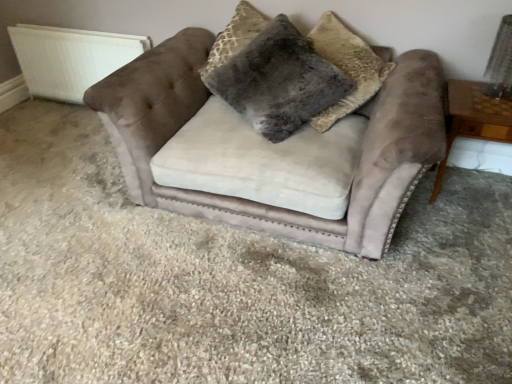
The height and width of the screenshot is (384, 512). I want to click on fuzzy gray pillow at center, which appears as the 2th pillow when viewed from the left, so click(x=347, y=67).

What is the approximate width of velvet couch at center?

It is 3.55 feet.

In order to face wooden side table at right, should I rotate leftwards or rightwards?

You should rotate right by 28.436 degrees.

What do you see at coordinates (279, 81) in the screenshot? I see `fuzzy gray pillow at center, which is counted as the 2th pillow, starting from the right` at bounding box center [279, 81].

Image resolution: width=512 pixels, height=384 pixels. Find the location of `fuzzy gray pillow at center, which appears as the 2th pillow when viewed from the left`. fuzzy gray pillow at center, which appears as the 2th pillow when viewed from the left is located at coordinates (347, 67).

Considering the positions of points (93, 65) and (437, 177), is point (93, 65) closer to camera compared to point (437, 177)?

That is False.

Is white textured radiator at upper left at the left side of wooden side table at right?

Indeed, white textured radiator at upper left is positioned on the left side of wooden side table at right.

How far apart are white textured radiator at upper left and wooden side table at right?

white textured radiator at upper left and wooden side table at right are 7.81 feet apart from each other.

Would you say fuzzy gray pillow at center, which appears as the 2th pillow when viewed from the left, is part of white textured radiator at upper left's contents?

No.

Based on the photo, does white textured radiator at upper left have a greater width compared to fuzzy gray pillow at center, which appears as the 2th pillow when viewed from the left?

No.

Looking at the image, does white textured radiator at upper left seem bigger or smaller compared to fuzzy gray pillow at center, which appears as the 2th pillow when viewed from the left?

In the image, white textured radiator at upper left appears to be smaller than fuzzy gray pillow at center, which appears as the 2th pillow when viewed from the left.

Consider the image. Is white textured radiator at upper left with fuzzy gray pillow at center, which appears as the 2th pillow when viewed from the left?

No, white textured radiator at upper left is not in contact with fuzzy gray pillow at center, which appears as the 2th pillow when viewed from the left.

Can you confirm if wooden side table at right is positioned to the right of fuzzy gray pillow at center, which appears as the 2th pillow when viewed from the left?

Correct, you'll find wooden side table at right to the right of fuzzy gray pillow at center, which appears as the 2th pillow when viewed from the left.

In the scene shown: Which of these two, wooden side table at right or fuzzy gray pillow at center, which appears as the 2th pillow when viewed from the left, is smaller?

With smaller size is wooden side table at right.

From the image's perspective, which pillow is the 1st one above the wooden side table at right? Please provide its 2D coordinates.

[(347, 67)]

In the scene shown: Considering the relative sizes of fuzzy gray pillow at center, which is the first pillow from left to right, and white textured radiator at upper left in the image provided, is fuzzy gray pillow at center, which is the first pillow from left to right, bigger than white textured radiator at upper left?

Indeed, fuzzy gray pillow at center, which is the first pillow from left to right, has a larger size compared to white textured radiator at upper left.

Considering the relative sizes of fuzzy gray pillow at center, which is counted as the 2th pillow, starting from the right, and white textured radiator at upper left in the image provided, is fuzzy gray pillow at center, which is counted as the 2th pillow, starting from the right, shorter than white textured radiator at upper left?

In fact, fuzzy gray pillow at center, which is counted as the 2th pillow, starting from the right, may be taller than white textured radiator at upper left.

Is fuzzy gray pillow at center, which is counted as the 2th pillow, starting from the right, to the left of white textured radiator at upper left from the viewer's perspective?

In fact, fuzzy gray pillow at center, which is counted as the 2th pillow, starting from the right, is to the right of white textured radiator at upper left.

Identify the location of radiator lying behind the fuzzy gray pillow at center, which is counted as the 2th pillow, starting from the right. coord(70,58).

From the image's perspective, between velvet couch at center and fuzzy gray pillow at center, which appears as the 2th pillow when viewed from the left, who is located below?

From the image's view, velvet couch at center is below.

Which of these two, velvet couch at center or fuzzy gray pillow at center, which appears as the 2th pillow when viewed from the left, stands taller?

velvet couch at center.

From a real-world perspective, which is physically above, velvet couch at center or fuzzy gray pillow at center, which appears as the 2th pillow when viewed from the left?

In real-world perspective, fuzzy gray pillow at center, which appears as the 2th pillow when viewed from the left, is above.

Which object is wider, fuzzy gray pillow at center, the first pillow when ordered from right to left, or fuzzy gray pillow at center, which is counted as the 2th pillow, starting from the right?

fuzzy gray pillow at center, which is counted as the 2th pillow, starting from the right, is wider.

Considering the points (370, 77) and (302, 44), which point is behind, point (370, 77) or point (302, 44)?

Point (370, 77)

Is fuzzy gray pillow at center, which appears as the 2th pillow when viewed from the left, touching fuzzy gray pillow at center, which is the first pillow from left to right?

No, fuzzy gray pillow at center, which appears as the 2th pillow when viewed from the left, is not touching fuzzy gray pillow at center, which is the first pillow from left to right.

Considering the positions of objects white textured radiator at upper left and fuzzy gray pillow at center, which is the first pillow from left to right, in the image provided, who is more to the right, white textured radiator at upper left or fuzzy gray pillow at center, which is the first pillow from left to right,?

fuzzy gray pillow at center, which is the first pillow from left to right, is more to the right.

In the image, is white textured radiator at upper left positioned in front of or behind fuzzy gray pillow at center, which is the first pillow from left to right?

Clearly, white textured radiator at upper left is behind fuzzy gray pillow at center, which is the first pillow from left to right.

Is white textured radiator at upper left taller than fuzzy gray pillow at center, which is the first pillow from left to right?

Incorrect, the height of white textured radiator at upper left is not larger of that of fuzzy gray pillow at center, which is the first pillow from left to right.

From the image's perspective, is white textured radiator at upper left located above or below fuzzy gray pillow at center, which is counted as the 2th pillow, starting from the right?

white textured radiator at upper left is above fuzzy gray pillow at center, which is counted as the 2th pillow, starting from the right.

What are the coordinates of `radiator above the wooden side table at right (from the image's perspective)` in the screenshot? It's located at (70, 58).

Locate an element on the screen. The height and width of the screenshot is (384, 512). the 2nd pillow in front of the white textured radiator at upper left, starting your count from the anchor is located at coordinates (347, 67).

Looking at the image, which one is located further to velvet couch at center, wooden side table at right or white textured radiator at upper left?

Among the two, white textured radiator at upper left is located further to velvet couch at center.

Considering their positions, is fuzzy gray pillow at center, the first pillow when ordered from right to left, positioned closer to velvet couch at center than white textured radiator at upper left?

The object closer to velvet couch at center is fuzzy gray pillow at center, the first pillow when ordered from right to left.

Which object lies further to the anchor point velvet couch at center, wooden side table at right or fuzzy gray pillow at center, which is the first pillow from left to right?

The object further to velvet couch at center is wooden side table at right.

Estimate the real-world distances between objects in this image. Which object is further from white textured radiator at upper left, velvet couch at center or wooden side table at right?

wooden side table at right is further to white textured radiator at upper left.

From the image, which object appears to be farther from wooden side table at right, fuzzy gray pillow at center, which appears as the 2th pillow when viewed from the left, or white textured radiator at upper left?

The object further to wooden side table at right is white textured radiator at upper left.

When comparing their distances from wooden side table at right, does fuzzy gray pillow at center, which is the first pillow from left to right, or fuzzy gray pillow at center, the first pillow when ordered from right to left, seem further?

The object further to wooden side table at right is fuzzy gray pillow at center, which is the first pillow from left to right.

Estimate the real-world distances between objects in this image. Which object is further from wooden side table at right, fuzzy gray pillow at center, the first pillow when ordered from right to left, or velvet couch at center?

velvet couch at center is positioned further to the anchor wooden side table at right.

Estimate the real-world distances between objects in this image. Which object is closer to white textured radiator at upper left, fuzzy gray pillow at center, the first pillow when ordered from right to left, or wooden side table at right?

fuzzy gray pillow at center, the first pillow when ordered from right to left, lies closer to white textured radiator at upper left than the other object.

Image resolution: width=512 pixels, height=384 pixels. What are the coordinates of `chair situated between fuzzy gray pillow at center, which is the first pillow from left to right, and wooden side table at right from left to right` in the screenshot? It's located at (271, 150).

Identify the location of pillow between white textured radiator at upper left and velvet couch at center from left to right. (279, 81).

Identify the location of pillow situated between velvet couch at center and wooden side table at right from left to right. This screenshot has height=384, width=512. (347, 67).

Identify the location of pillow between fuzzy gray pillow at center, which is the first pillow from left to right, and wooden side table at right, in the horizontal direction. (347, 67).